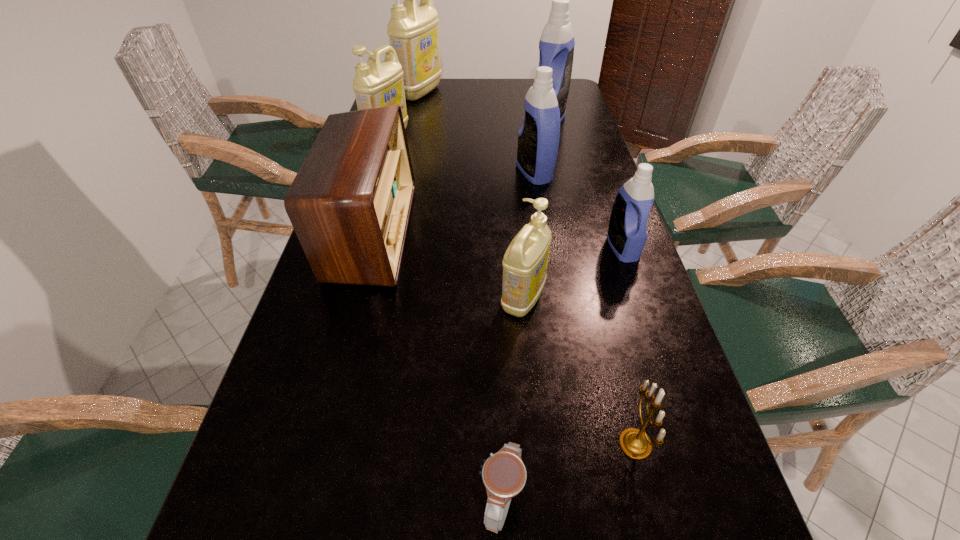
Identify the location of unoccupied position between the eighth tallest object and the smallest beige detergent. (579, 371).

Locate an element on the screen. vacant space in between the biggest blue detergent and the second smallest beige detergent is located at coordinates (468, 130).

The image size is (960, 540). What are the coordinates of `vacant space in between the second biggest blue detergent and the rightmost detergent` in the screenshot? It's located at 578,210.

This screenshot has width=960, height=540. What are the coordinates of `vacant point located between the candelabrum and the radio receiver` in the screenshot? It's located at (503, 338).

Select which object is the fifth closest to the second smallest beige detergent. Please provide its 2D coordinates. Your answer should be formatted as a tuple, i.e. [(x, y)], where the tuple contains the x and y coordinates of a point satisfying the conditions above.

[(525, 261)]

Point out which object is positioned as the nearest to the farthest beige detergent. Please provide its 2D coordinates. Your answer should be formatted as a tuple, i.e. [(x, y)], where the tuple contains the x and y coordinates of a point satisfying the conditions above.

[(376, 84)]

Identify the location of the fifth closest detergent relative to the third nearest detergent. (413, 31).

The height and width of the screenshot is (540, 960). I want to click on the second closest detergent to the farthest object, so click(x=556, y=46).

Where is `the third closest beige detergent relative to the radio receiver`? the third closest beige detergent relative to the radio receiver is located at coordinates (413, 31).

Locate which beige detergent is the closest to the gold candelabrum. Please provide its 2D coordinates. Your answer should be formatted as a tuple, i.e. [(x, y)], where the tuple contains the x and y coordinates of a point satisfying the conditions above.

[(525, 261)]